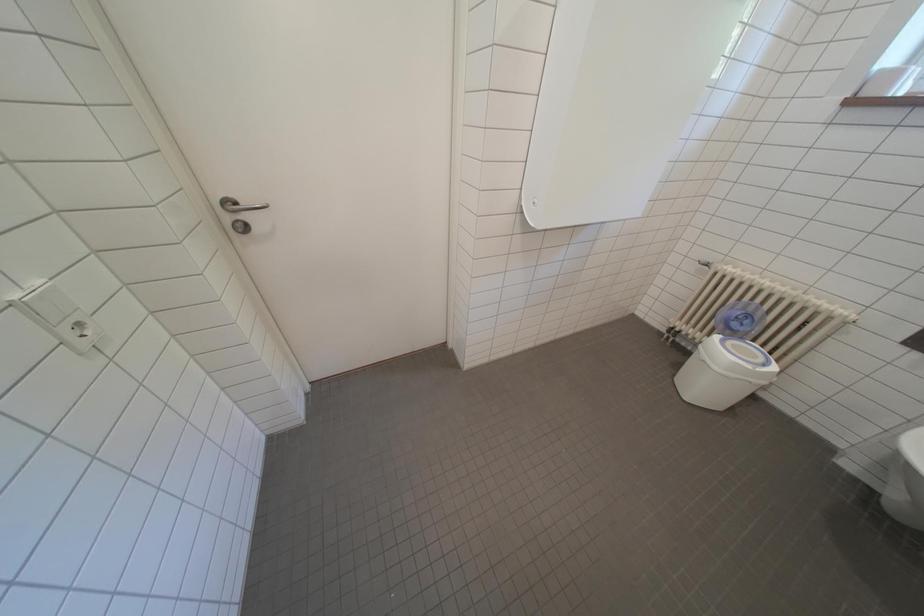
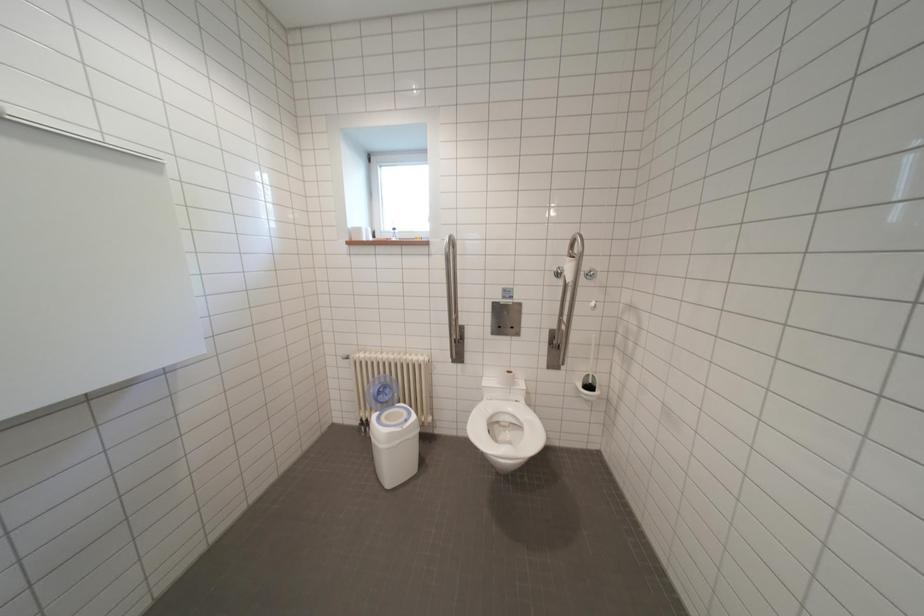
Question: Based on the continuous images, in which direction is the camera rotating? Reply with the corresponding letter.

Choices:
 (A) Left
 (B) Right
 (C) Up
 (D) Down

Answer: (B)